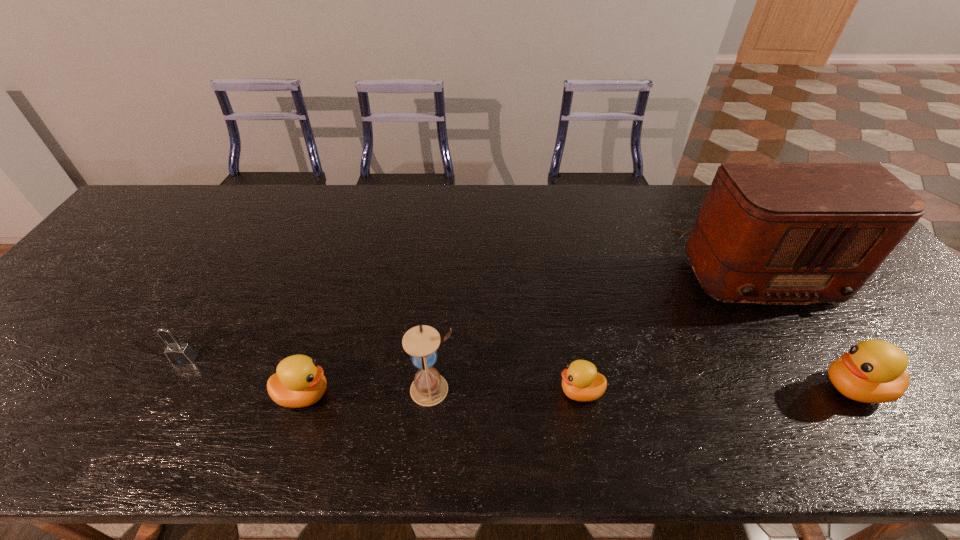
At what (x,y) coordinates should I click in order to perform the action: click on blank space located on the front panel of the farthest object. Please return your answer as a coordinate pair (x, y). The width and height of the screenshot is (960, 540). Looking at the image, I should click on (814, 360).

Where is `vacant position located 0.370m on the right of the fifth shortest object`? This screenshot has width=960, height=540. vacant position located 0.370m on the right of the fifth shortest object is located at coordinates (623, 389).

The width and height of the screenshot is (960, 540). Find the location of `hourglass that is at the near edge`. hourglass that is at the near edge is located at coordinates (429, 388).

Where is `object positioned at the right edge`? Image resolution: width=960 pixels, height=540 pixels. object positioned at the right edge is located at coordinates (768, 233).

The image size is (960, 540). Find the location of `blank space at the far edge of the desktop`. blank space at the far edge of the desktop is located at coordinates (653, 215).

Where is `free space at the near edge`? This screenshot has height=540, width=960. free space at the near edge is located at coordinates (468, 373).

Find the location of a particular element. This screenshot has width=960, height=540. free space between the shortest object and the second tallest object is located at coordinates (507, 390).

This screenshot has height=540, width=960. I want to click on empty location between the second duckling from right to left and the hourglass, so click(x=507, y=390).

At what (x,y) coordinates should I click in order to perform the action: click on empty space between the rightmost duckling and the shortest object. Please return your answer as a coordinate pair (x, y). This screenshot has width=960, height=540. Looking at the image, I should click on (717, 390).

This screenshot has width=960, height=540. Find the location of `vacant area that lies between the padlock and the farthest object`. vacant area that lies between the padlock and the farthest object is located at coordinates 470,313.